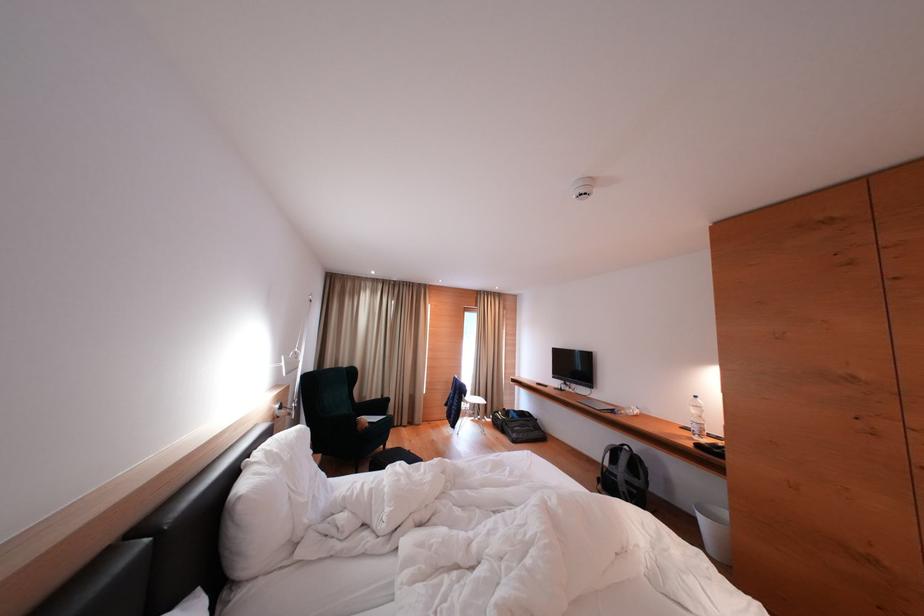
Which object does [623,475] point to?

It corresponds to the small black bag in the image.